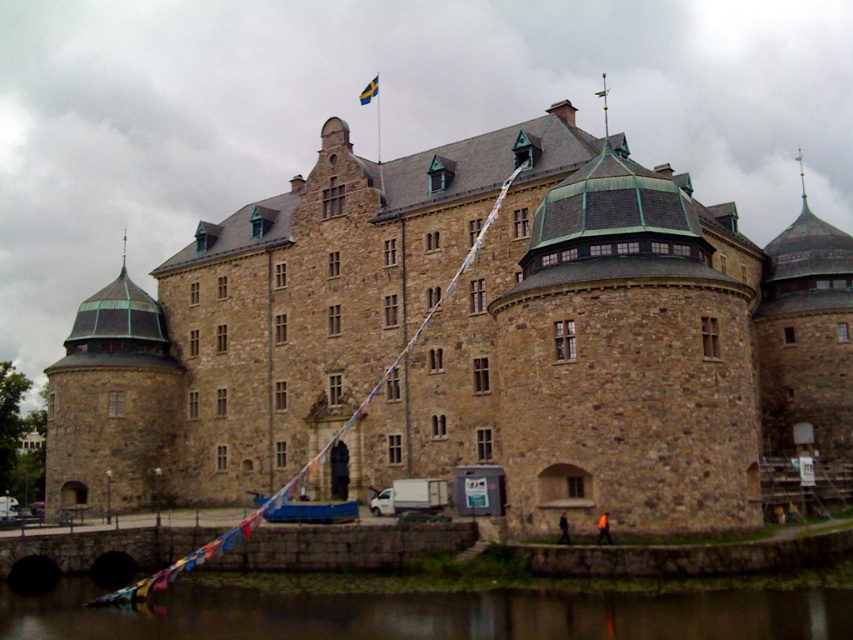
Question: Considering the relative positions of green leafy water at lower center and brown stone building at center in the image provided, where is green leafy water at lower center located with respect to brown stone building at center?

Choices:
 (A) right
 (B) left

Answer: (B)

Question: Which point is farther to the camera?

Choices:
 (A) brown stone castle at center
 (B) brown stone building at center
 (C) green leafy water at lower center

Answer: (B)

Question: Which object is farther from the camera taking this photo?

Choices:
 (A) green leafy water at lower center
 (B) brown stone building at center

Answer: (B)

Question: Where is brown stone castle at center located in relation to brown stone building at center in the image?

Choices:
 (A) right
 (B) left

Answer: (A)

Question: Can you confirm if brown stone castle at center is positioned to the left of green leafy water at lower center?

Choices:
 (A) yes
 (B) no

Answer: (B)

Question: Which point is closer to the camera?

Choices:
 (A) green leafy water at lower center
 (B) brown stone castle at center

Answer: (A)